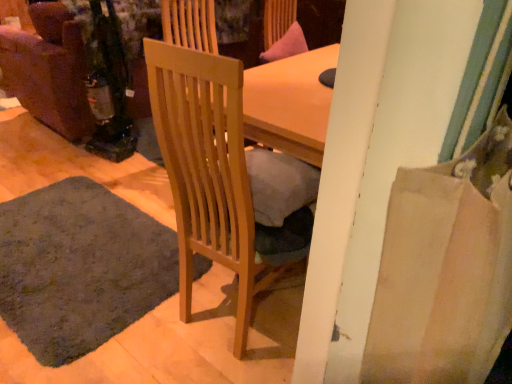
This screenshot has width=512, height=384. Find the location of `free space between light wood chair at center and dark gray carpet at lower left`. free space between light wood chair at center and dark gray carpet at lower left is located at coordinates (154, 325).